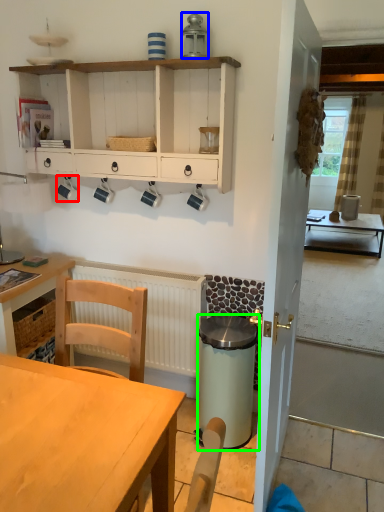
Question: Which is nearer to the coffee cup (highlighted by a red box)? appliance (highlighted by a blue box) or trash bin/can (highlighted by a green box).

Choices:
 (A) appliance
 (B) trash bin/can

Answer: (A)